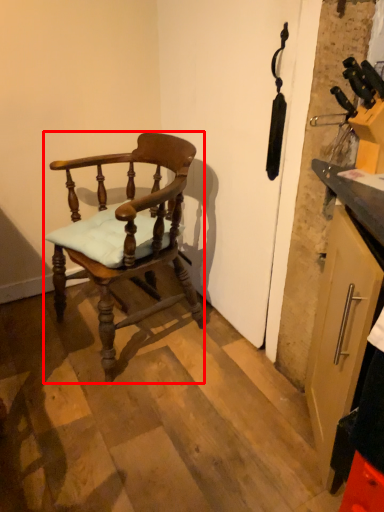
Question: From the image's perspective, considering the relative positions of chair (annotated by the red box) and cabinetry in the image provided, where is chair (annotated by the red box) located with respect to the staircase?

Choices:
 (A) below
 (B) above

Answer: (B)